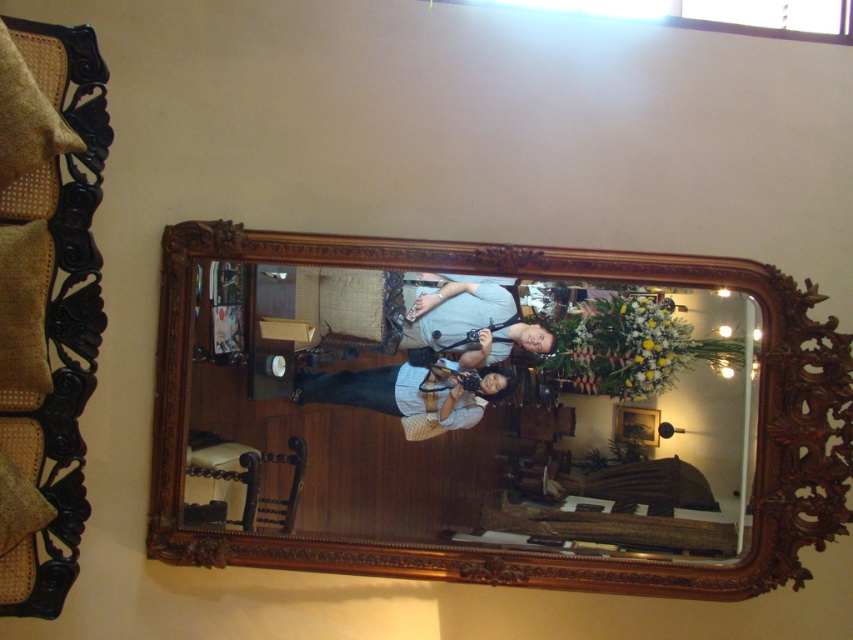
Question: Which of the following is the closest to the observer?

Choices:
 (A) wooden mirror at center
 (B) matte gray shirt at center

Answer: (A)

Question: Is wooden mirror at center wider than matte gray shirt at center?

Choices:
 (A) no
 (B) yes

Answer: (B)

Question: Does wooden mirror at center appear on the left side of matte gray shirt at center?

Choices:
 (A) yes
 (B) no

Answer: (B)

Question: Which point appears farthest from the camera in this image?

Choices:
 (A) (537, 332)
 (B) (634, 340)

Answer: (A)

Question: Does wooden mirror at center have a larger size compared to matte gray shirt at center?

Choices:
 (A) yes
 (B) no

Answer: (A)